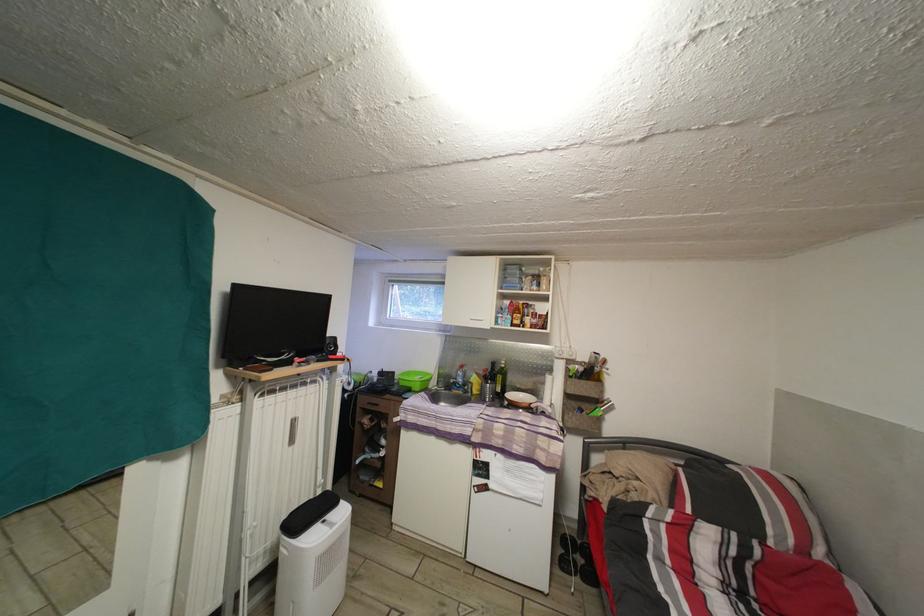
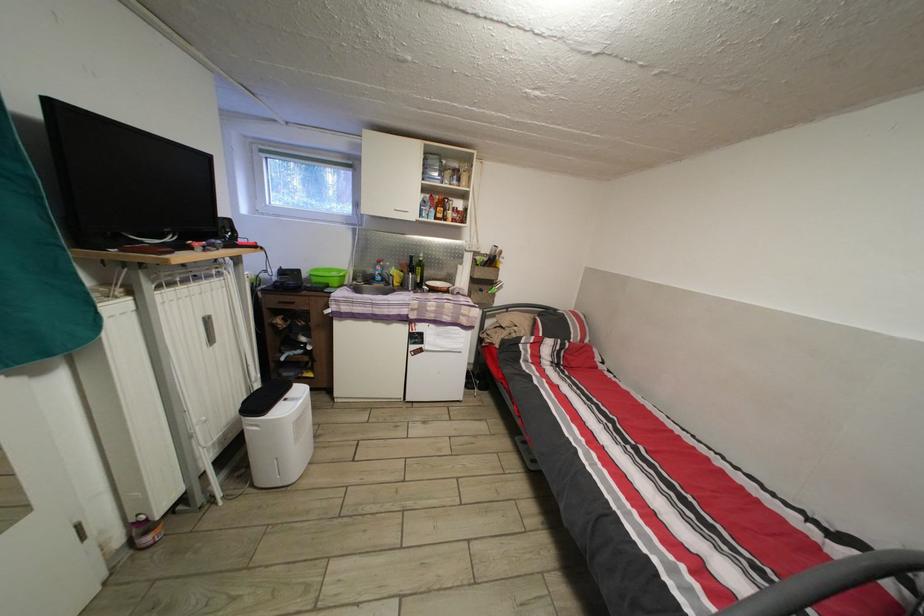
Find the pixel in the second image that matches the point at 477,392 in the first image.

(398, 285)